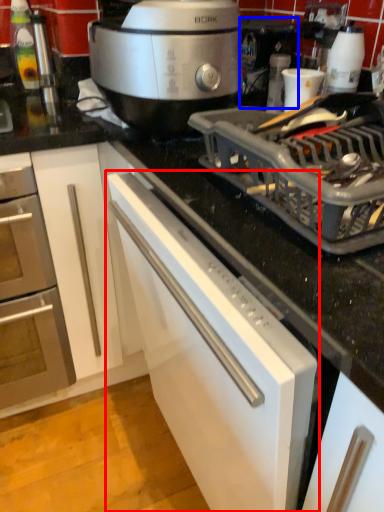
Question: Which object appears farthest to the camera in this image, cabinetry (highlighted by a red box) or coffee machine (highlighted by a blue box)?

Choices:
 (A) cabinetry
 (B) coffee machine

Answer: (B)